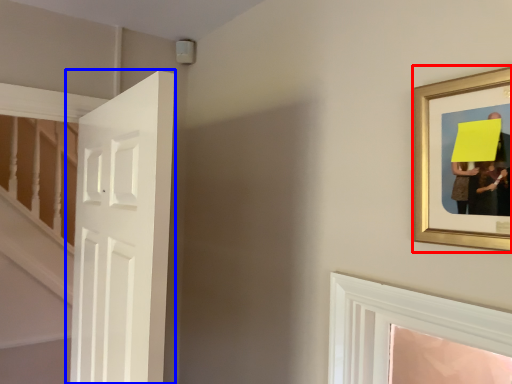
Question: Which object is further to the camera taking this photo, picture frame (highlighted by a red box) or door (highlighted by a blue box)?

Choices:
 (A) picture frame
 (B) door

Answer: (B)